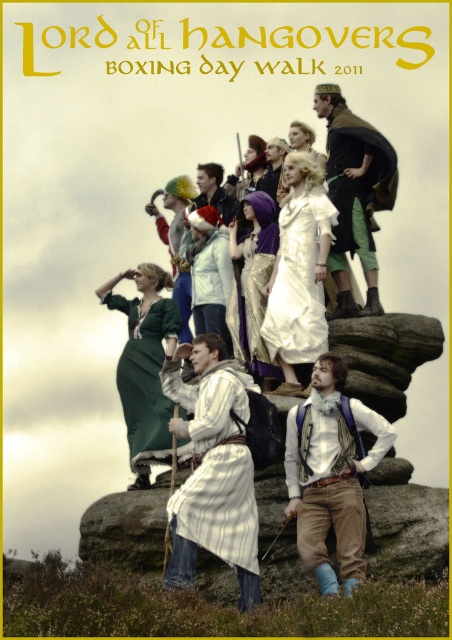
Question: Which point is farther from the camera taking this photo?

Choices:
 (A) (337, 225)
 (B) (419, 346)

Answer: (A)

Question: Considering the relative positions of brown rough rock at center and green fabric cape at upper right in the image provided, where is brown rough rock at center located with respect to green fabric cape at upper right?

Choices:
 (A) left
 (B) right

Answer: (A)

Question: Is brown rough rock at center smaller than brown textured rock at center?

Choices:
 (A) yes
 (B) no

Answer: (B)

Question: Which point appears farthest from the camera in this image?

Choices:
 (A) (230, 465)
 (B) (141, 468)
 (C) (285, 531)

Answer: (B)

Question: Can you confirm if light brown corduroy pants at center is positioned to the left of green fabric cape at upper right?

Choices:
 (A) yes
 (B) no

Answer: (A)

Question: Which point is closer to the camera taking this photo?

Choices:
 (A) (220, 189)
 (B) (363, 522)
 (C) (267, 339)
 (D) (136, 497)

Answer: (B)